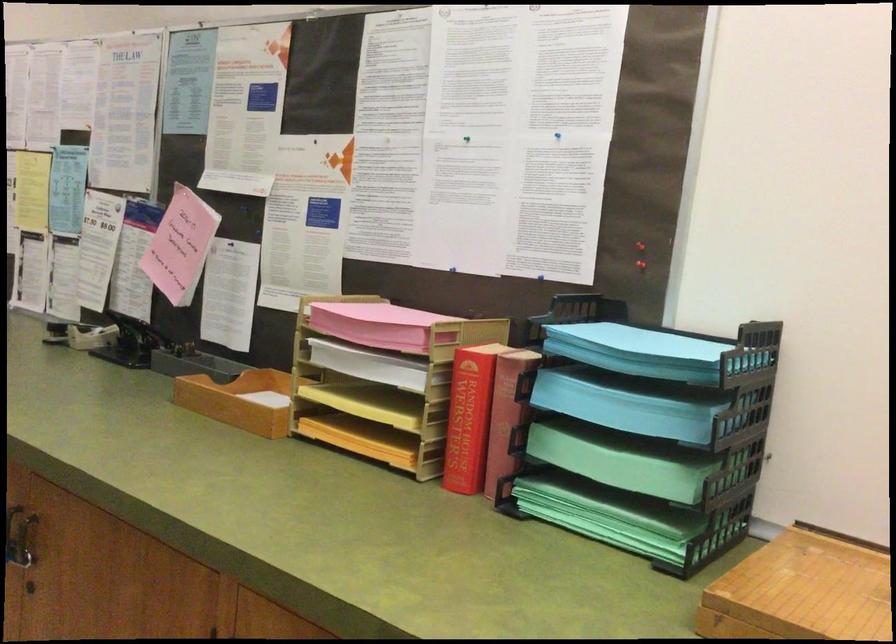
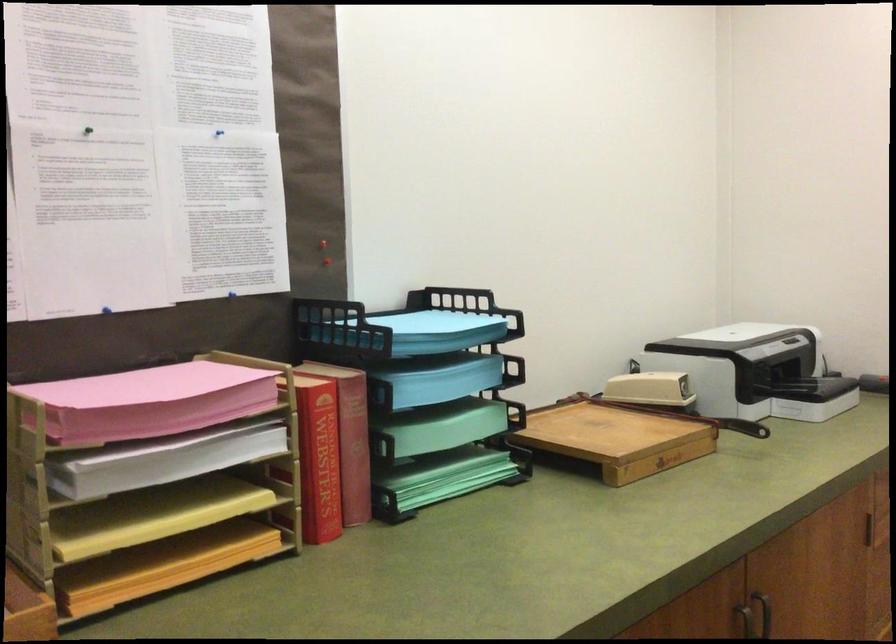
Locate, in the second image, the point that corresponds to the point at 380,359 in the first image.

(179, 450)